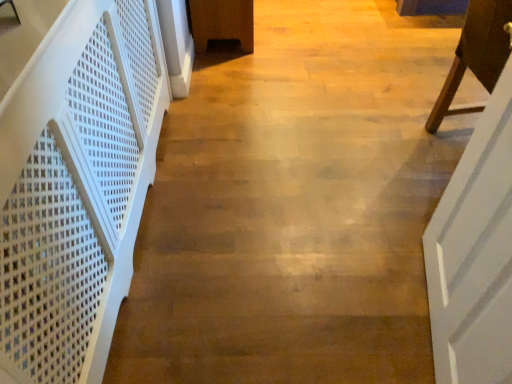
Locate an element on the screen. This screenshot has width=512, height=384. unoccupied area behind brown wooden chair at right is located at coordinates (416, 92).